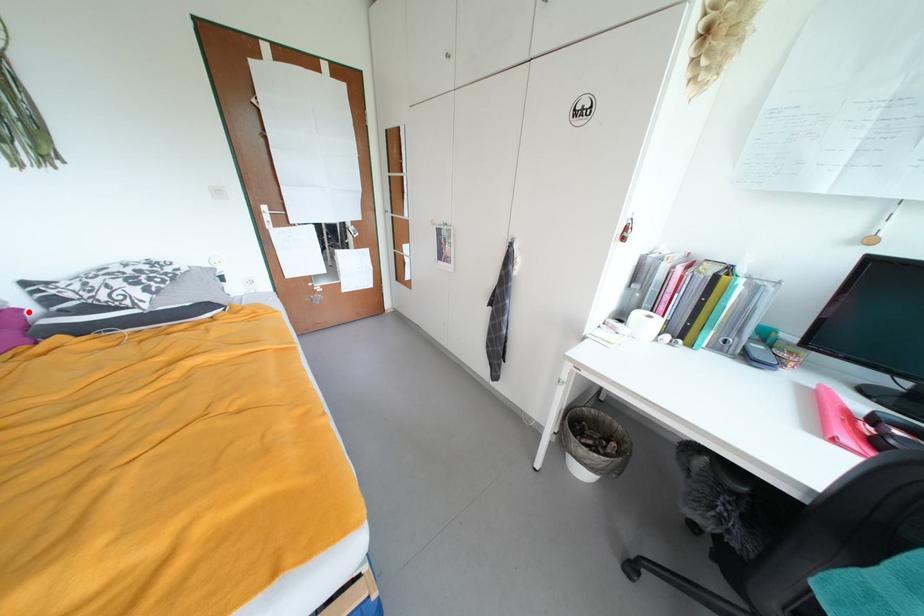
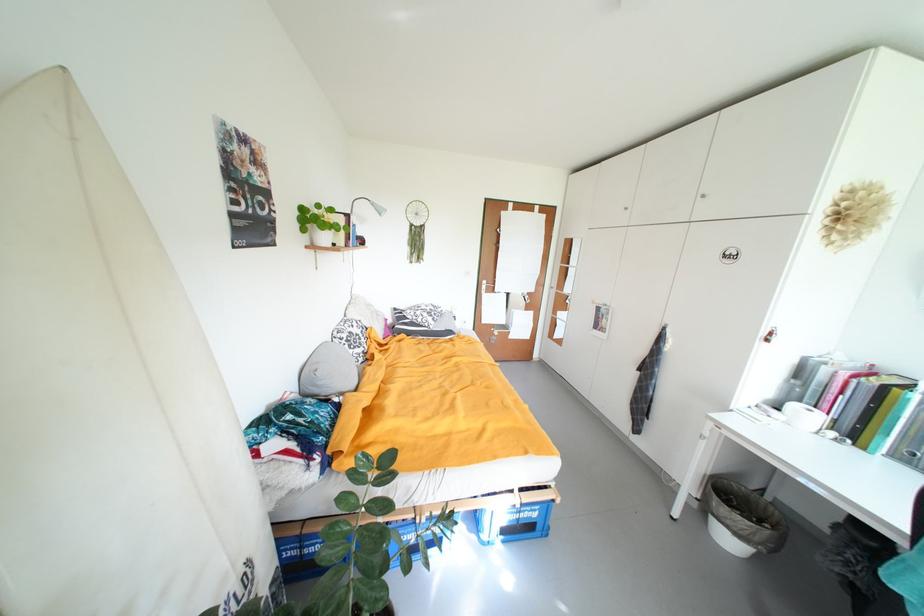
Question: I am providing you with two images of the same scene from different viewpoints. In image1, a red point is highlighted. Considering the same 3D point in image2, which of the following is correct?

Choices:
 (A) It is closer
 (B) It is farther

Answer: (A)